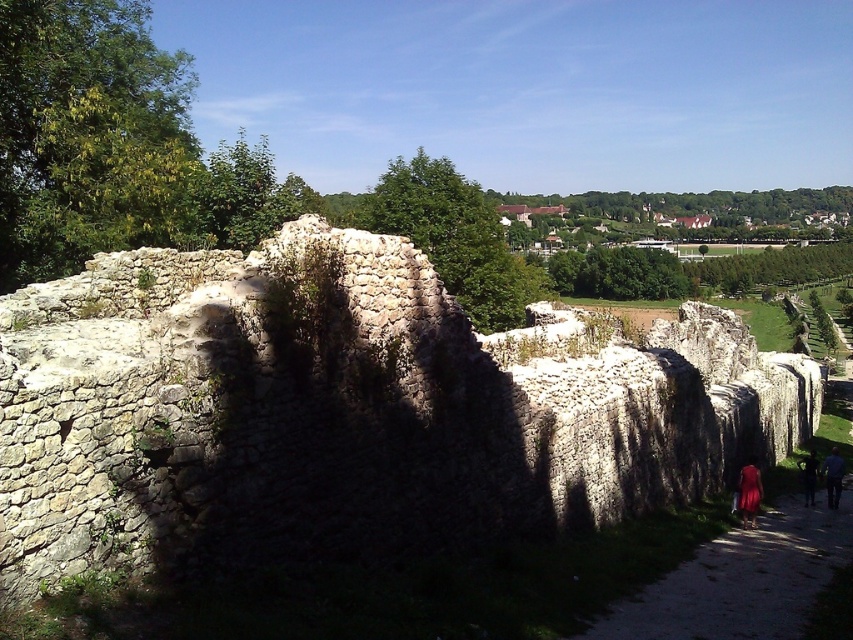
Looking at this image, which is below, dirt path at lower right or matte red dress at lower right?

dirt path at lower right is below.

Which of these two, dirt path at lower right or matte red dress at lower right, stands taller?

With more height is dirt path at lower right.

The width and height of the screenshot is (853, 640). Identify the location of dirt path at lower right. (741, 579).

Does matte red dress at lower right appear on the right side of blue denim jeans at lower right?

No, matte red dress at lower right is not to the right of blue denim jeans at lower right.

Is point (744, 472) positioned in front of point (839, 497)?

Yes, it is in front of point (839, 497).

The image size is (853, 640). I want to click on matte red dress at lower right, so click(749, 492).

Can you confirm if dirt path at lower right is taller than dark blue jeans at lower right?

No, dirt path at lower right is not taller than dark blue jeans at lower right.

Measure the distance between dirt path at lower right and dark blue jeans at lower right.

dirt path at lower right and dark blue jeans at lower right are 57.02 feet apart from each other.

Does point (721, 556) come in front of point (811, 480)?

Yes, point (721, 556) is closer to viewer.

You are a GUI agent. You are given a task and a screenshot of the screen. Output one action in this format:
    pyautogui.click(x=<x>, y=<y>)
    Task: Click on the dirt path at lower right
    Image resolution: width=853 pixels, height=640 pixels.
    Given the screenshot: What is the action you would take?
    pyautogui.click(x=741, y=579)